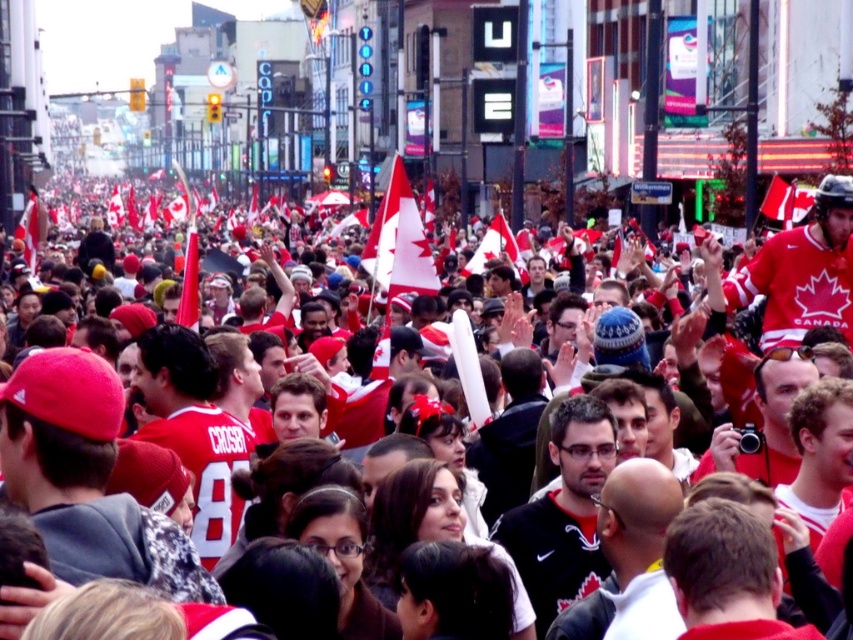
Which of these two, red fabric crowd at center or red fabric flag at upper right, stands shorter?

Standing shorter between the two is red fabric flag at upper right.

Between red fabric crowd at center and red fabric flag at upper right, which one has more height?

With more height is red fabric crowd at center.

The image size is (853, 640). Describe the element at coordinates (582, 529) in the screenshot. I see `red fabric crowd at center` at that location.

The width and height of the screenshot is (853, 640). I want to click on red fabric crowd at center, so click(x=582, y=529).